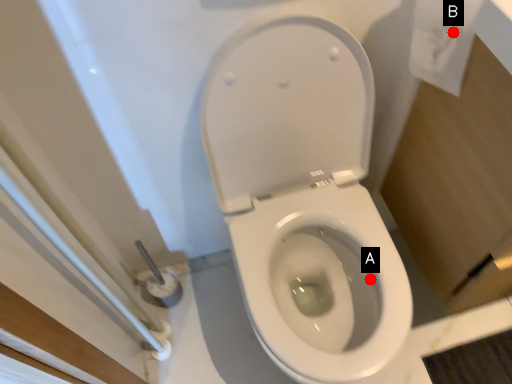
Question: Two points are circled on the image, labeled by A and B beside each circle. Which of the following is the farthest from the observer?

Choices:
 (A) A is further
 (B) B is further

Answer: (A)